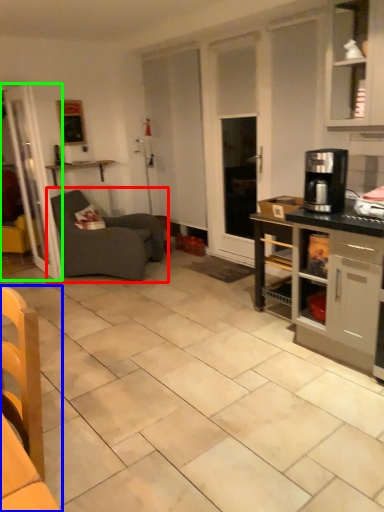
Question: Which object is positioned closest to studio couch (highlighted by a red box)? Select from chair (highlighted by a blue box) and glass door (highlighted by a green box).

Choices:
 (A) chair
 (B) glass door

Answer: (B)